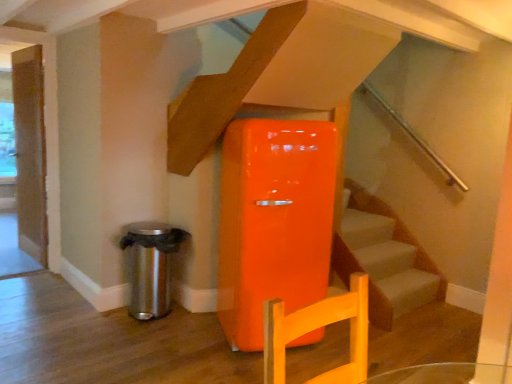
Question: Does wooden door at left come in front of polished stainless steel trash can at lower left?

Choices:
 (A) no
 (B) yes

Answer: (A)

Question: From the image's perspective, is wooden door at left on top of polished stainless steel trash can at lower left?

Choices:
 (A) no
 (B) yes

Answer: (B)

Question: Does wooden door at left have a lesser width compared to polished stainless steel trash can at lower left?

Choices:
 (A) no
 (B) yes

Answer: (B)

Question: Is wooden door at left at the left side of polished stainless steel trash can at lower left?

Choices:
 (A) yes
 (B) no

Answer: (A)

Question: Would you say polished stainless steel trash can at lower left is part of wooden door at left's contents?

Choices:
 (A) no
 (B) yes

Answer: (A)

Question: Is wooden door at left outside of polished stainless steel trash can at lower left?

Choices:
 (A) no
 (B) yes

Answer: (B)

Question: Is polished stainless steel trash can at lower left not within wooden door at left?

Choices:
 (A) no
 (B) yes

Answer: (B)

Question: Is polished stainless steel trash can at lower left taller than wooden door at left?

Choices:
 (A) yes
 (B) no

Answer: (B)

Question: Is polished stainless steel trash can at lower left positioned with its back to wooden door at left?

Choices:
 (A) no
 (B) yes

Answer: (B)

Question: Is polished stainless steel trash can at lower left closer to camera compared to wooden door at left?

Choices:
 (A) no
 (B) yes

Answer: (B)

Question: From the image's perspective, is polished stainless steel trash can at lower left beneath wooden door at left?

Choices:
 (A) yes
 (B) no

Answer: (A)

Question: Is polished stainless steel trash can at lower left far away from wooden door at left?

Choices:
 (A) no
 (B) yes

Answer: (B)

Question: Is point (126, 235) closer or farther from the camera than point (34, 200)?

Choices:
 (A) farther
 (B) closer

Answer: (B)